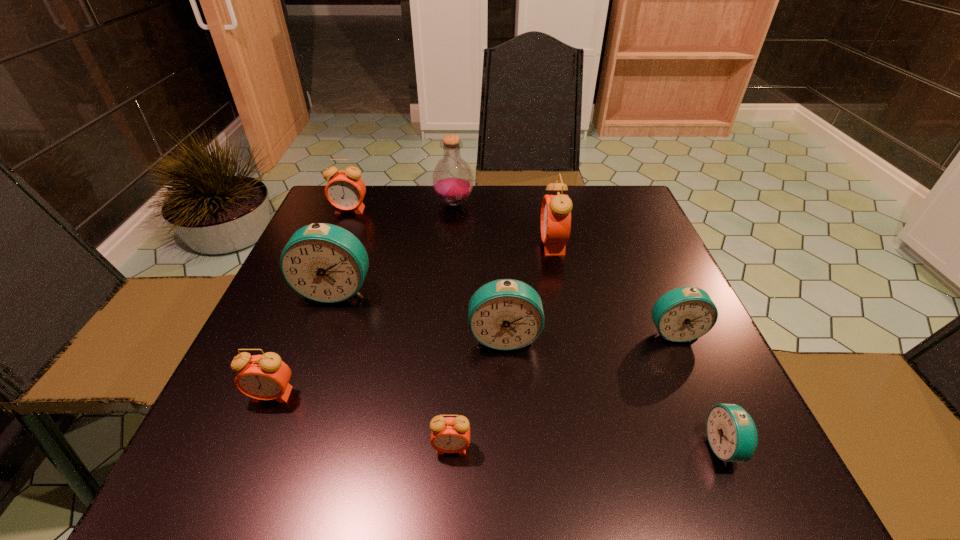
This screenshot has width=960, height=540. In the image, there is a desktop. Find the location of `free space at the near edge`. free space at the near edge is located at coordinates (559, 468).

Find the location of a particular element. This screenshot has width=960, height=540. blank space at the left edge of the desktop is located at coordinates (274, 297).

Locate an element on the screen. This screenshot has width=960, height=540. vacant space at the far left corner of the desktop is located at coordinates (375, 211).

The image size is (960, 540). In the image, there is a desktop. Identify the location of free space at the near right corner. (735, 466).

Image resolution: width=960 pixels, height=540 pixels. I want to click on free space between the smallest pink alarm clock and the third biggest blue alarm clock, so click(563, 390).

You are a GUI agent. You are given a task and a screenshot of the screen. Output one action in this format:
    pyautogui.click(x=<x>, y=<y>)
    Task: Click on the free space between the second biggest blue alarm clock and the leftmost blue alarm clock
    The image size is (960, 540).
    Given the screenshot: What is the action you would take?
    pyautogui.click(x=420, y=314)

In order to click on free space between the leftmost blue alarm clock and the smallest blue alarm clock in this screenshot , I will do `click(530, 369)`.

Where is `vacant space that's between the second blue alarm clock from left to right and the third biggest blue alarm clock`? The image size is (960, 540). vacant space that's between the second blue alarm clock from left to right and the third biggest blue alarm clock is located at coordinates (588, 334).

Where is `blank region between the smallest blue alarm clock and the rightmost pink alarm clock`? The height and width of the screenshot is (540, 960). blank region between the smallest blue alarm clock and the rightmost pink alarm clock is located at coordinates (638, 346).

The image size is (960, 540). Find the location of `free area in between the seventh nearest object and the third biggest blue alarm clock`. free area in between the seventh nearest object and the third biggest blue alarm clock is located at coordinates (612, 288).